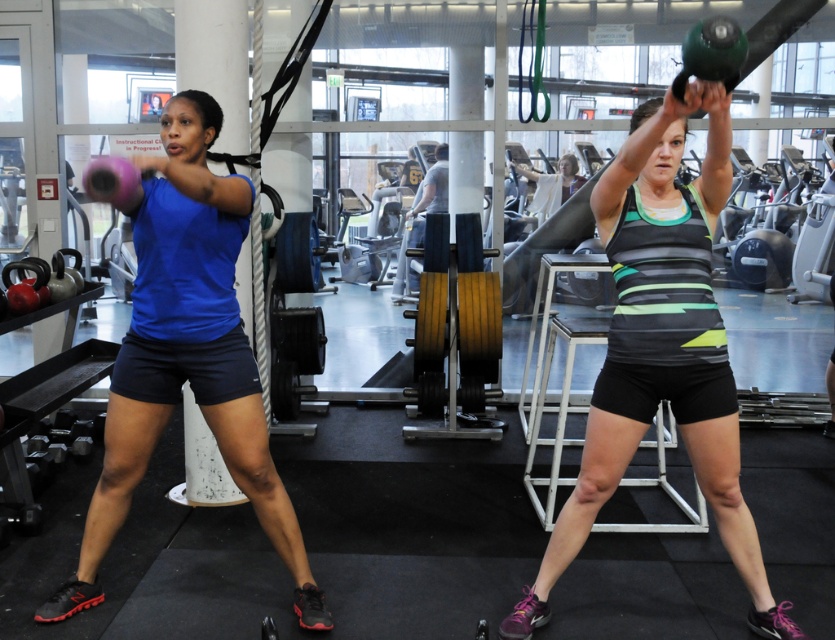
You are a gym trainer assessing the kettlebell sizes for a client. The client needs to use the smaller kettlebell for their exercise routine. Which kettlebell should they choose between the matte black kettlebell at center and the matte pink kettlebell at left?

The matte pink kettlebell at left is smaller in size compared to the matte black kettlebell at center, so the client should choose the matte pink kettlebell at left for their exercise routine.

You are a gym trainer planning to place a new equipment rack in the gym. The rack will be placed at point 0.5, 0.8. Considering the location of the matte black kettlebell at center, will the rack interfere with it?

The matte black kettlebell at center is located at point (661, 346). The new equipment rack will be placed at (668, 320). Since the coordinates are very close, there might be interference between the rack and the matte black kettlebell at center.

You are a gym trainer observing the kettlebell workout session. You notice a point marked at coordinates (661, 346). Which object does this point correspond to?

The point at coordinates (661, 346) corresponds to the matte black kettlebell at center.